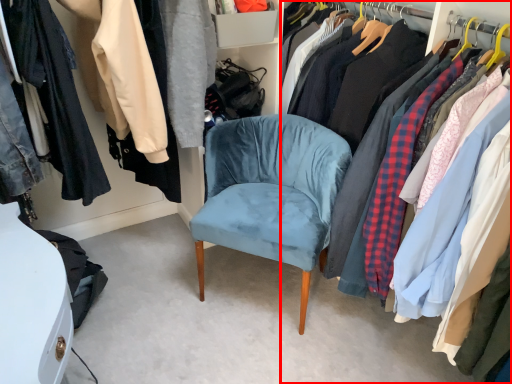
Question: From the image, what is the correct spatial relationship of closet (annotated by the red box) in relation to chair?

Choices:
 (A) left
 (B) right

Answer: (B)